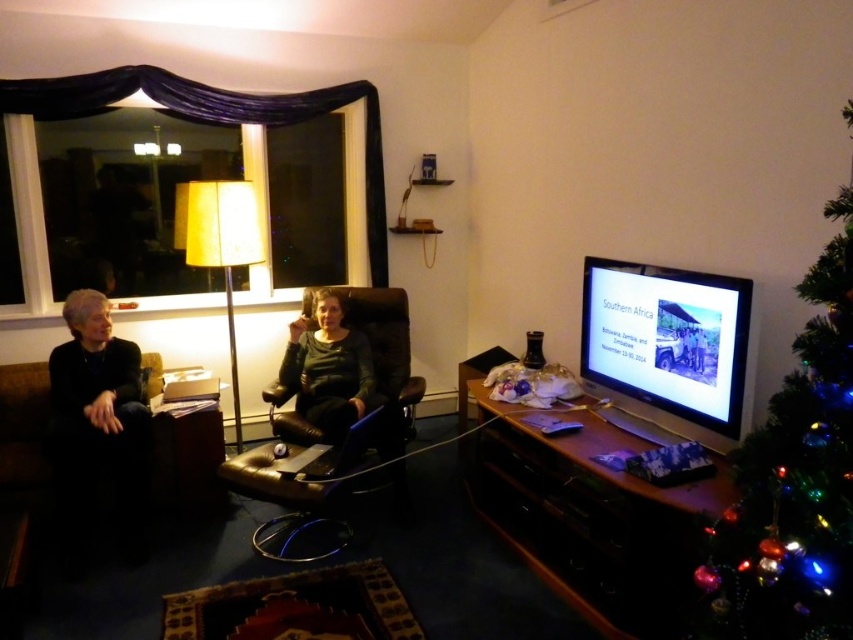
You are planning to place a 2.5 meters long sofa in the living room. The black leather couch at left and the matte black chair at center are already present. Based on their sizes, which object should you consider removing to make space for the new sofa?

The black leather couch at left is wider than the matte black chair at center. Therefore, removing the black leather couch at left would free up more space, making it the better option to accommodate the new 2.5 meters long sofa.

You are planning to place a new coffee table between the green artificial christmas tree at right and the black leather couch at left. Based on their positions, which side of the coffee table should be closer to the tree?

The green artificial christmas tree at right is positioned on the right side of black leather couch at left, so the right side of the coffee table should be closer to the tree.

You are planning to place a new coffee table between the green artificial christmas tree at right and the matte black chair at center. The coffee table requires at least 1.8 meters of space to fit comfortably. Based on the scene, can the coffee table be placed there?

The distance between the green artificial christmas tree at right and the matte black chair at center is 2.09 meters. Since the required space is 1.8 meters, the coffee table can be placed there comfortably as there is enough space.